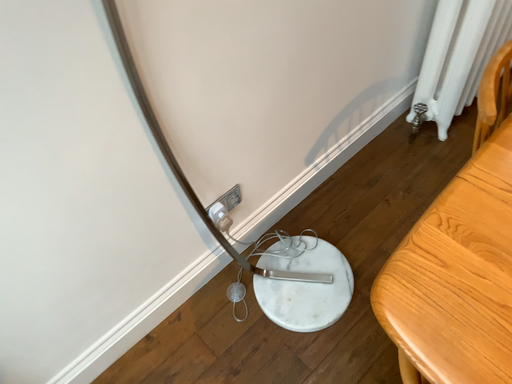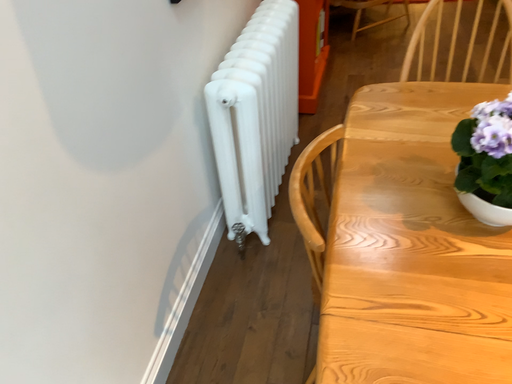
Question: Which way did the camera rotate in the video?

Choices:
 (A) rotated right
 (B) rotated left

Answer: (A)